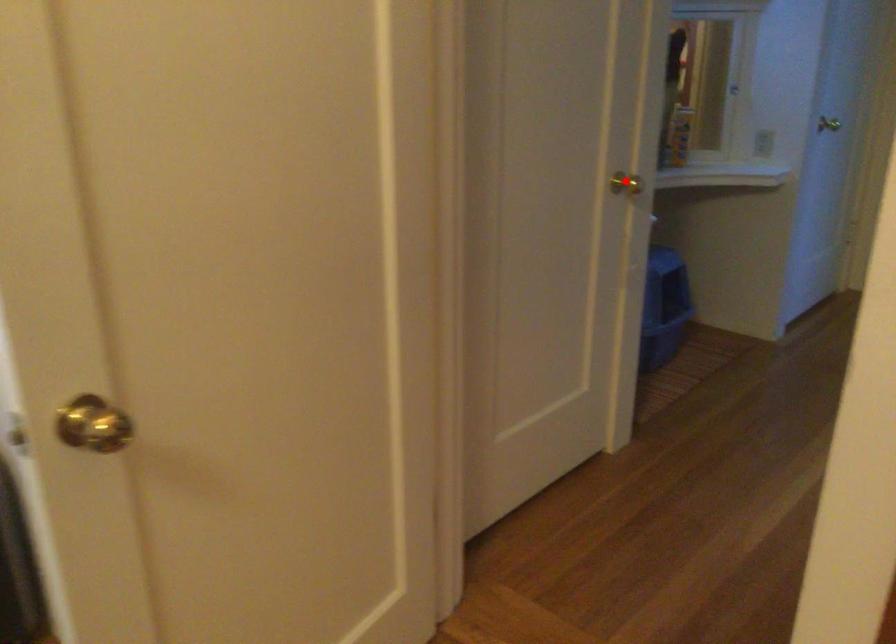
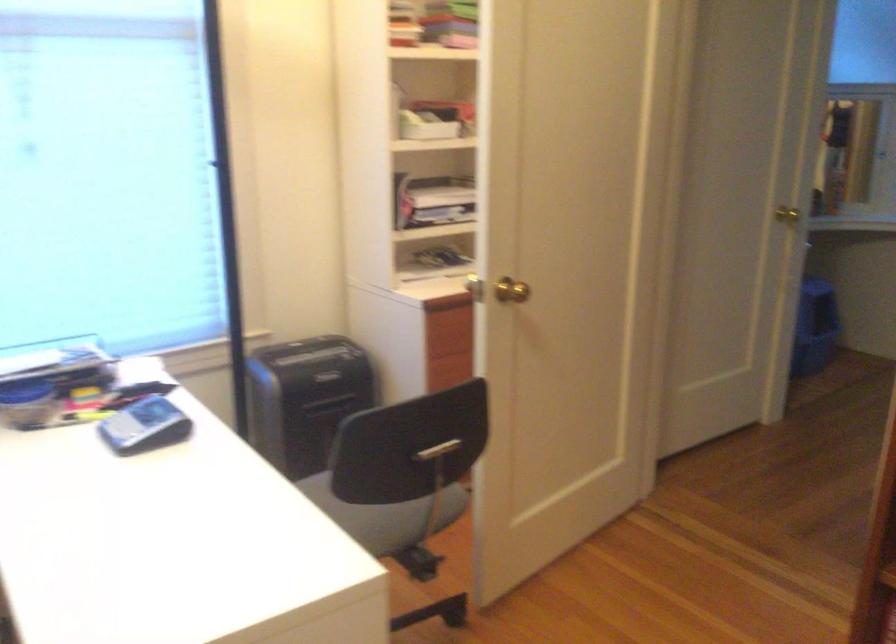
Question: I am providing you with two images of the same scene from different viewpoints. Image1 has a red point marked. In image2, the corresponding 3D location appears at what relative position? Reply with the corresponding letter.

Choices:
 (A) Closer
 (B) Farther

Answer: (B)